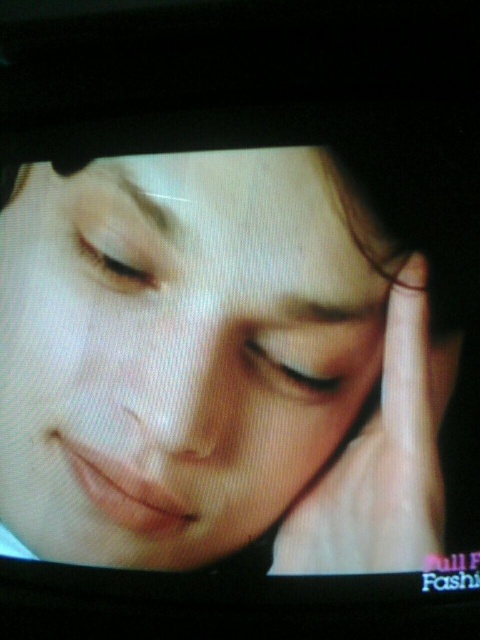
You are a photographer analyzing the image on the TV screen. You notice the smooth skin finger at center and the matte white eye at center. Which object is nearer to you in this image?

The smooth skin finger at center is closer to the viewer than the matte white eye at center.

Consider the image. You are an animator working on a character design. You need to ensure that the smooth skin face at center is proportionally balanced with the matte white eye at center. Based on the scene description, which object has a greater width?

The smooth skin face at center has a greater width than the matte white eye at center, as stated in the object description that the smooth skin face at center surpasses the matte white eye at center in width.